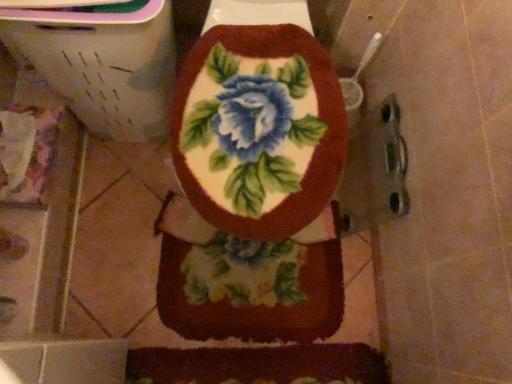
Question: Should I look upward or downward to see fluffy floral rug at center?

Choices:
 (A) down
 (B) up

Answer: (A)

Question: From a real-world perspective, is floral fabric toilet seat at center on top of fluffy floral rug at center?

Choices:
 (A) no
 (B) yes

Answer: (B)

Question: Is floral fabric toilet seat at center wider than fluffy floral rug at center?

Choices:
 (A) yes
 (B) no

Answer: (A)

Question: Does floral fabric toilet seat at center appear on the left side of fluffy floral rug at center?

Choices:
 (A) no
 (B) yes

Answer: (B)

Question: Does floral fabric toilet seat at center lie in front of fluffy floral rug at center?

Choices:
 (A) no
 (B) yes

Answer: (B)

Question: Does floral fabric toilet seat at center have a lesser width compared to fluffy floral rug at center?

Choices:
 (A) no
 (B) yes

Answer: (A)

Question: Is floral fabric toilet seat at center facing away from fluffy floral rug at center?

Choices:
 (A) no
 (B) yes

Answer: (B)

Question: Considering the relative positions of fluffy floral rug at center and floral fabric toilet seat at center in the image provided, is fluffy floral rug at center to the left of floral fabric toilet seat at center from the viewer's perspective?

Choices:
 (A) yes
 (B) no

Answer: (B)

Question: Does fluffy floral rug at center have a smaller size compared to floral fabric toilet seat at center?

Choices:
 (A) no
 (B) yes

Answer: (B)

Question: From the image's perspective, does fluffy floral rug at center appear higher than floral fabric toilet seat at center?

Choices:
 (A) no
 (B) yes

Answer: (A)

Question: Is fluffy floral rug at center positioned with its back to floral fabric toilet seat at center?

Choices:
 (A) yes
 (B) no

Answer: (A)

Question: Is fluffy floral rug at center far away from floral fabric toilet seat at center?

Choices:
 (A) yes
 (B) no

Answer: (B)

Question: Could you tell me if fluffy floral rug at center is turned towards floral fabric toilet seat at center?

Choices:
 (A) yes
 (B) no

Answer: (A)

Question: In the image, is floral fabric toilet seat at center positioned in front of or behind fluffy floral rug at center?

Choices:
 (A) front
 (B) behind

Answer: (A)